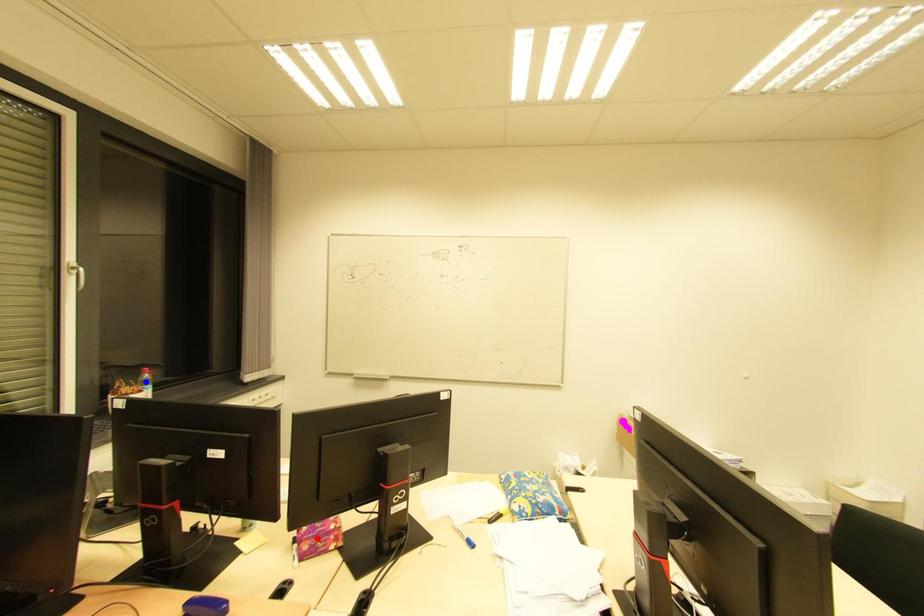
Question: Two points are marked on the image. Which point is closer to the camera?

Choices:
 (A) Blue point is closer.
 (B) Red point is closer.

Answer: (B)